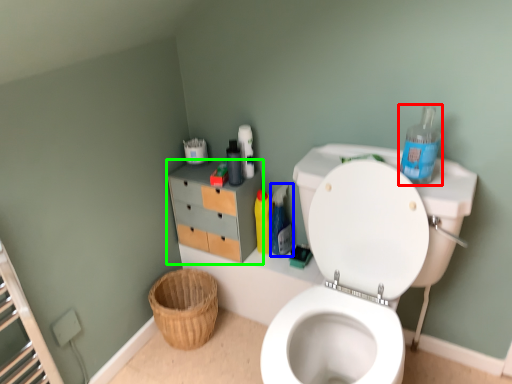
Question: Which object is positioned farthest from cleaning product (highlighted by a red box)? Select from cleaning product (highlighted by a blue box) and file cabinet (highlighted by a green box).

Choices:
 (A) cleaning product
 (B) file cabinet

Answer: (B)